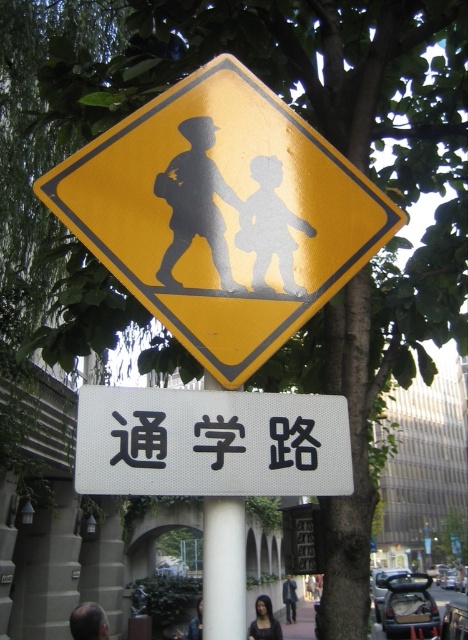
Question: Can you confirm if white smooth pole at center is positioned below blue fabric pedestrian at lower center?

Choices:
 (A) no
 (B) yes

Answer: (A)

Question: Observing the image, what is the correct spatial positioning of white textured sign at center in reference to matte gray figure at center?

Choices:
 (A) above
 (B) below

Answer: (B)

Question: Estimate the real-world distances between objects in this image. Which object is closer to the white smooth pole at center?

Choices:
 (A) dark hair at lower center
 (B) dark brown hair at lower left
 (C) blue fabric pedestrian at lower center
 (D) blackmaterial/texturesign at center

Answer: (D)

Question: Considering the real-world distances, which object is closest to the matte gray figure at center?

Choices:
 (A) yellow matte pedestrian crossing sign at upper center
 (B) dark gray fabric pedestrian at lower center
 (C) blue fabric pedestrian at lower center

Answer: (A)

Question: Is dark hair at lower center positioned in front of dark gray fabric pedestrian at lower center?

Choices:
 (A) yes
 (B) no

Answer: (A)

Question: Which of these objects is positioned closest to the white smooth pole at center?

Choices:
 (A) dark gray fabric pedestrian at lower center
 (B) dark brown hair at lower left
 (C) blackmaterial/texturesign at center

Answer: (C)